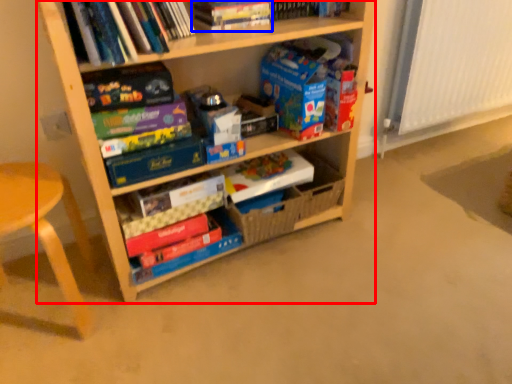
Question: Among these objects, which one is nearest to the camera, shelf (highlighted by a red box) or book (highlighted by a blue box)?

Choices:
 (A) shelf
 (B) book

Answer: (A)